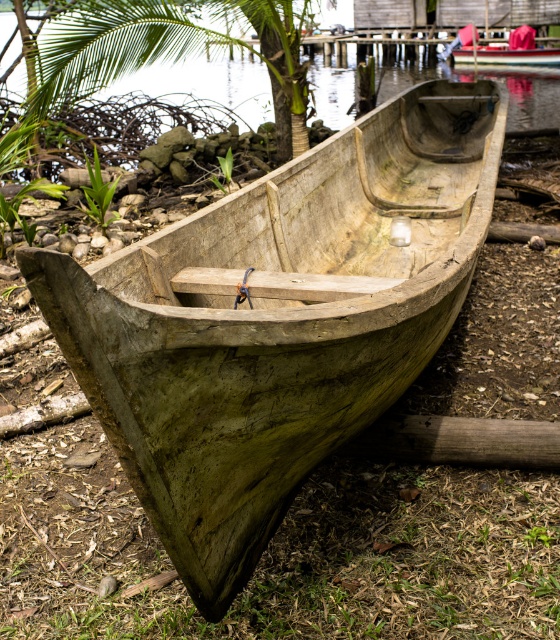
Question: Observing the image, what is the correct spatial positioning of green leafy tree at upper left in reference to wooden canoe at center?

Choices:
 (A) left
 (B) right

Answer: (A)

Question: Does green leafy tree at upper left have a greater width compared to wooden canoe at center?

Choices:
 (A) no
 (B) yes

Answer: (B)

Question: Can you confirm if green leafy tree at upper left is thinner than wooden canoe at center?

Choices:
 (A) yes
 (B) no

Answer: (B)

Question: Which object is farther from the camera taking this photo?

Choices:
 (A) wooden canoe at center
 (B) green leafy tree at upper left

Answer: (A)

Question: Among these objects, which one is farthest from the camera?

Choices:
 (A) wooden canoe at center
 (B) green leafy tree at upper left

Answer: (A)

Question: Which point appears farthest from the camera in this image?

Choices:
 (A) (520, 44)
 (B) (100, 38)

Answer: (A)